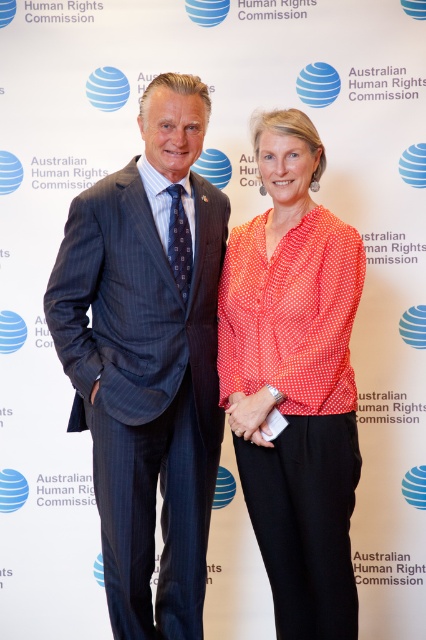
You are a photographer at the Australian Human Rights Commission event. You need to ensure that both the dark blue pinstripe suit at center and the polka dot blouse at center are clearly visible in the photo. Based on their positions, which one might be partially hidden if you focus on the other?

The polka dot blouse at center might be partially hidden because the dark blue pinstripe suit at center is in front of it.